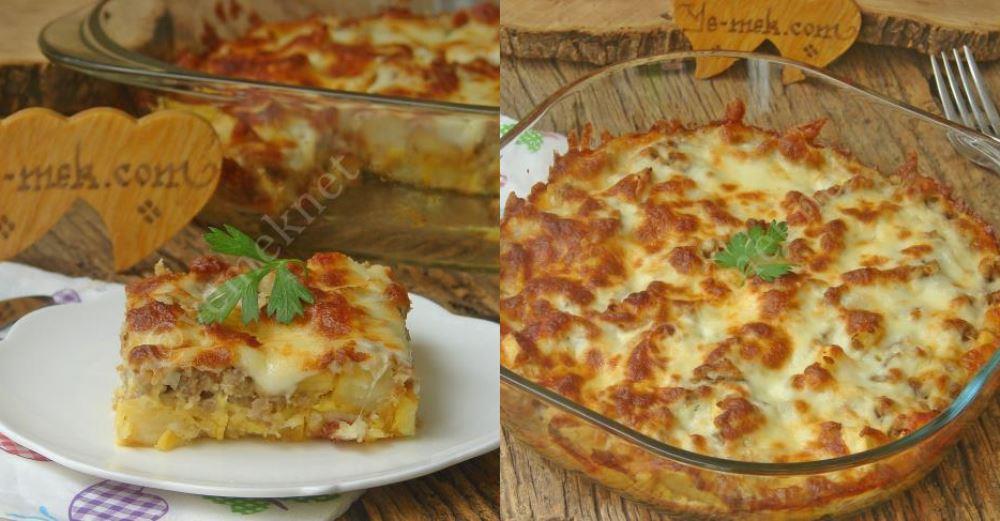
The image size is (1000, 521). Find the location of `table`. table is located at coordinates (413, 504).